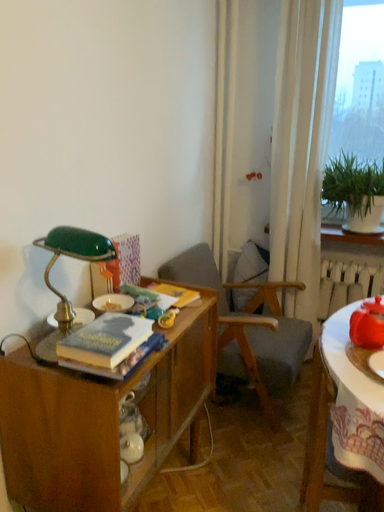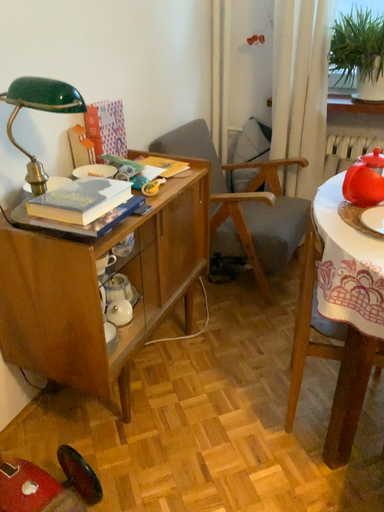
Question: How did the camera likely rotate when shooting the video?

Choices:
 (A) rotated upward
 (B) rotated downward

Answer: (B)